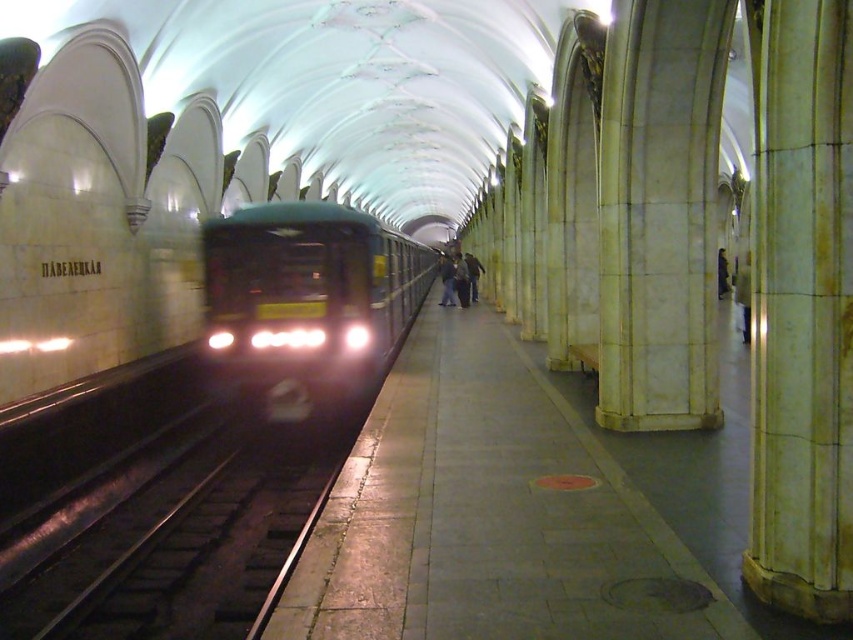
Is white marble pillar at right bigger than dark green metallic train at center?

Actually, white marble pillar at right might be smaller than dark green metallic train at center.

Is point (809, 100) closer to viewer compared to point (376, 246)?

Yes, it is.

What do you see at coordinates (801, 307) in the screenshot?
I see `white marble pillar at right` at bounding box center [801, 307].

The image size is (853, 640). In order to click on white marble pillar at right in this screenshot , I will do `click(801, 307)`.

Is point (283, 552) more distant than point (410, 300)?

That is False.

In order to click on metal/smooth train track at center in this screenshot , I will do `click(178, 545)`.

Does white marble pillar at right have a larger size compared to metal/smooth train track at center?

Yes.

Is point (846, 524) farther from viewer compared to point (50, 621)?

No, it is in front of (50, 621).

Image resolution: width=853 pixels, height=640 pixels. Identify the location of white marble pillar at right. (801, 307).